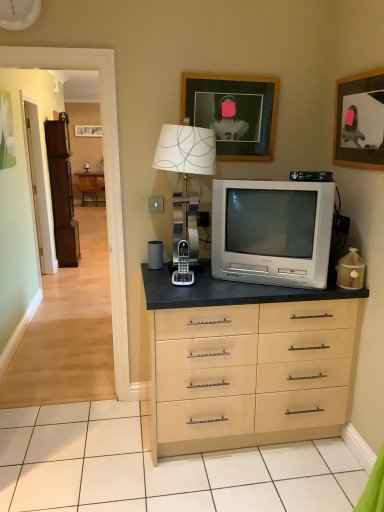
Question: From the image's perspective, relative to metallic silver table lamp at center, is wooden picture frame at upper right, the 1th picture frame viewed from the right, above or below?

Choices:
 (A) below
 (B) above

Answer: (B)

Question: Considering their positions, is wooden picture frame at upper right, marked as the 2th picture frame in a left-to-right arrangement, located in front of or behind metallic silver table lamp at center?

Choices:
 (A) behind
 (B) front

Answer: (B)

Question: Considering the real-world distances, which object is farthest from the brown wooden armoire at left?

Choices:
 (A) wooden picture frame at upper center, placed as the 1th picture frame when sorted from left to right
 (B) wooden picture frame at upper right, the 1th picture frame viewed from the right
 (C) slate gray matte speaker at center
 (D) metallic silver table lamp at center
 (E) wooden floor at left

Answer: (B)

Question: Estimate the real-world distances between objects in this image. Which object is farther from the black plastic phone at center?

Choices:
 (A) slate gray matte speaker at center
 (B) brown wooden armoire at left
 (C) silver metallic television at center
 (D) white matte clock at upper left
 (E) wooden floor at left

Answer: (B)